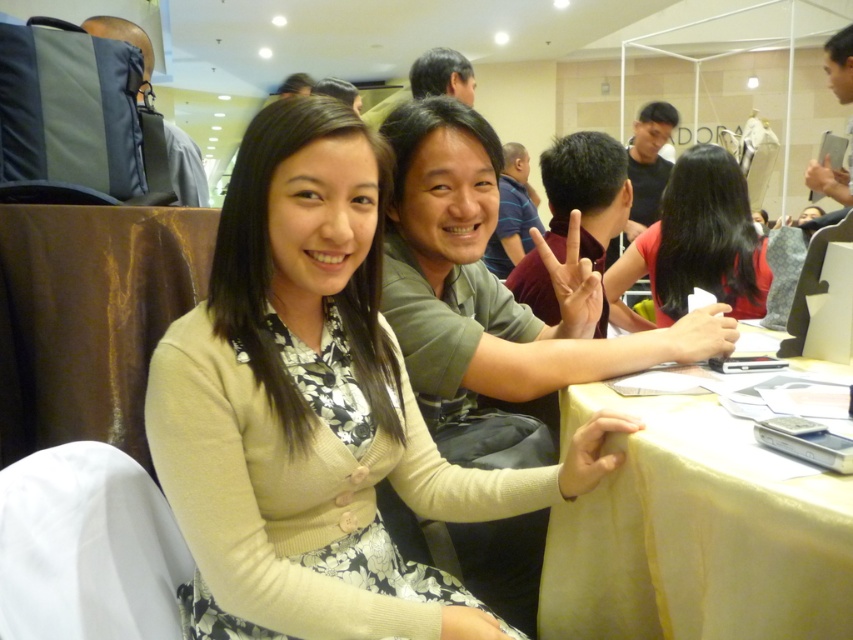
Does red matte shirt at center have a lesser height compared to matte green shirt at center?

Yes, red matte shirt at center is shorter than matte green shirt at center.

Does red matte shirt at center appear on the left side of matte green shirt at center?

In fact, red matte shirt at center is to the right of matte green shirt at center.

Between point (639, 259) and point (515, 193), which one is positioned behind?

Positioned behind is point (515, 193).

Where is `red matte shirt at center`? This screenshot has height=640, width=853. red matte shirt at center is located at coordinates (698, 241).

In the scene shown: Can you confirm if red matte shirt at center is shorter than black matte hair at center?

Incorrect, red matte shirt at center's height does not fall short of black matte hair at center's.

This screenshot has width=853, height=640. I want to click on red matte shirt at center, so click(698, 241).

At what (x,y) coordinates should I click in order to perform the action: click on red matte shirt at center. Please return your answer as a coordinate pair (x, y). Image resolution: width=853 pixels, height=640 pixels. Looking at the image, I should click on (698, 241).

Between point (664, 620) and point (630, 188), which one is positioned in front?

Point (664, 620) is more forward.

Between yellow fabric table at lower right and black matte hair at center, which one is positioned lower?

Positioned lower is yellow fabric table at lower right.

Measure the distance between point (828, 506) and camera.

The distance of point (828, 506) from camera is 28.55 inches.

Locate an element on the screen. This screenshot has height=640, width=853. yellow fabric table at lower right is located at coordinates (695, 532).